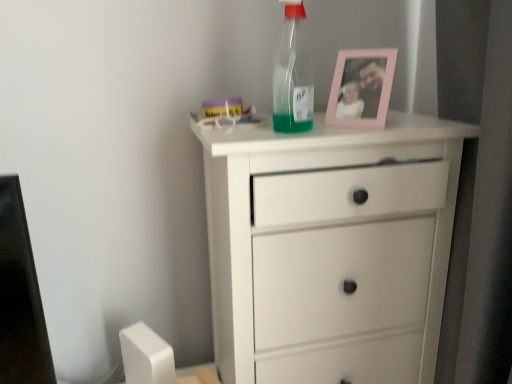
Question: In terms of size, does pink plastic picture frame at upper center appear bigger or smaller than transparent plastic bottle at upper center?

Choices:
 (A) big
 (B) small

Answer: (A)

Question: In the image, is pink plastic picture frame at upper center positioned in front of or behind transparent plastic bottle at upper center?

Choices:
 (A) behind
 (B) front

Answer: (A)

Question: Which object is positioned closest to the transparent plastic bottle at upper center?

Choices:
 (A) white matte chest of drawers at center
 (B) pink plastic picture frame at upper center

Answer: (B)

Question: Estimate the real-world distances between objects in this image. Which object is farther from the pink plastic picture frame at upper center?

Choices:
 (A) white matte chest of drawers at center
 (B) transparent plastic bottle at upper center

Answer: (A)